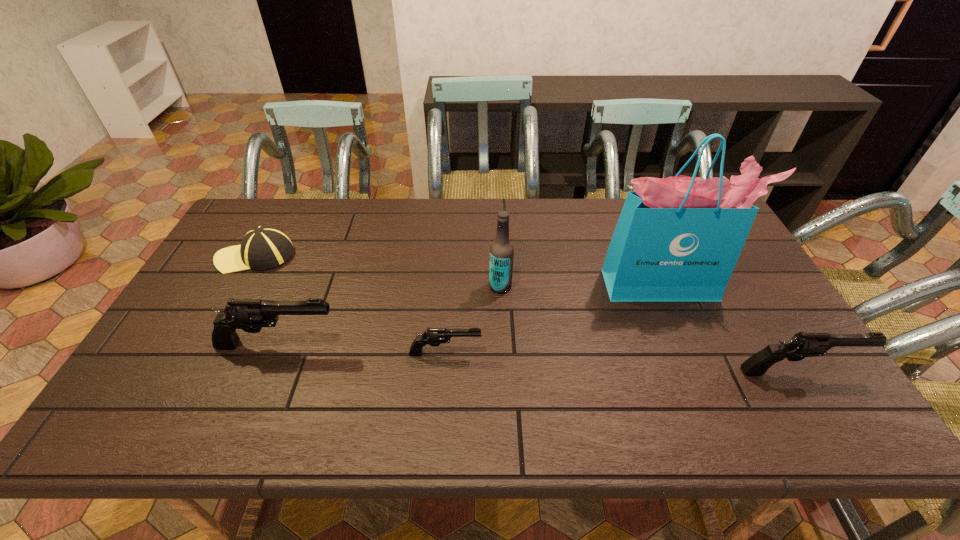
Locate an element on the screen. This screenshot has height=540, width=960. free space located 0.260m at the end of the barrel of the shortest gun is located at coordinates (585, 353).

Find the location of `vacant space situated 0.130m on the left of the shopping bag`. vacant space situated 0.130m on the left of the shopping bag is located at coordinates (562, 285).

Where is `free region located on the label of the beer bottle`? free region located on the label of the beer bottle is located at coordinates (447, 286).

This screenshot has width=960, height=540. Identify the location of vacant space located 0.240m on the label of the beer bottle. (406, 286).

This screenshot has width=960, height=540. I want to click on free space located 0.220m on the label of the beer bottle, so click(x=414, y=286).

At what (x,y) coordinates should I click in order to perform the action: click on object situated at the far edge. Please return your answer as a coordinate pair (x, y). The height and width of the screenshot is (540, 960). Looking at the image, I should click on (264, 247).

You are a GUI agent. You are given a task and a screenshot of the screen. Output one action in this format:
    pyautogui.click(x=<x>, y=<y>)
    Task: Click on the object that is at the near edge
    The image size is (960, 540).
    Given the screenshot: What is the action you would take?
    pyautogui.click(x=801, y=345)

Where is `gun at the left edge`? This screenshot has height=540, width=960. gun at the left edge is located at coordinates (250, 315).

Image resolution: width=960 pixels, height=540 pixels. What are the coordinates of `baseball cap at the left edge` in the screenshot? It's located at (264, 247).

Locate an element on the screen. The width and height of the screenshot is (960, 540). gun positioned at the right edge is located at coordinates (801, 345).